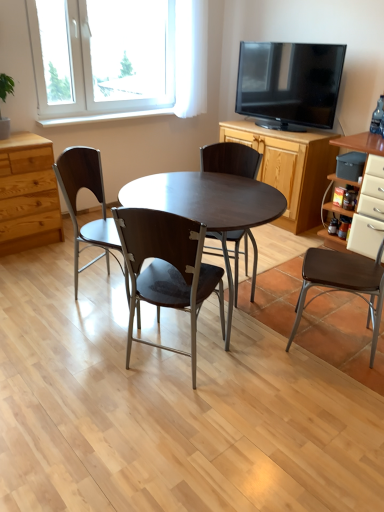
Identify the location of vacant region under brown leather chair at right, the first chair from the right (from a real-world perspective). The height and width of the screenshot is (512, 384). (334, 336).